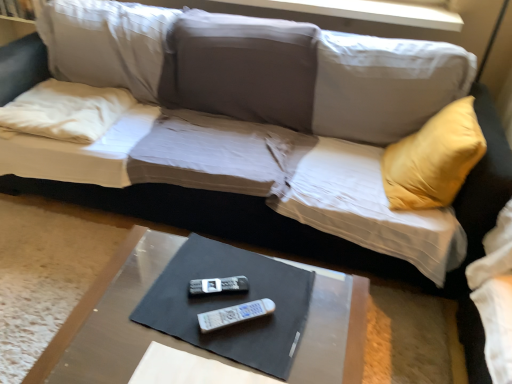
You are a GUI agent. You are given a task and a screenshot of the screen. Output one action in this format:
    pyautogui.click(x=<x>, y=<y>)
    Task: Click on the free space to the back side of black plastic remote at center, which is the first remote from top to bottom
    The height and width of the screenshot is (384, 512).
    Given the screenshot: What is the action you would take?
    pyautogui.click(x=220, y=259)